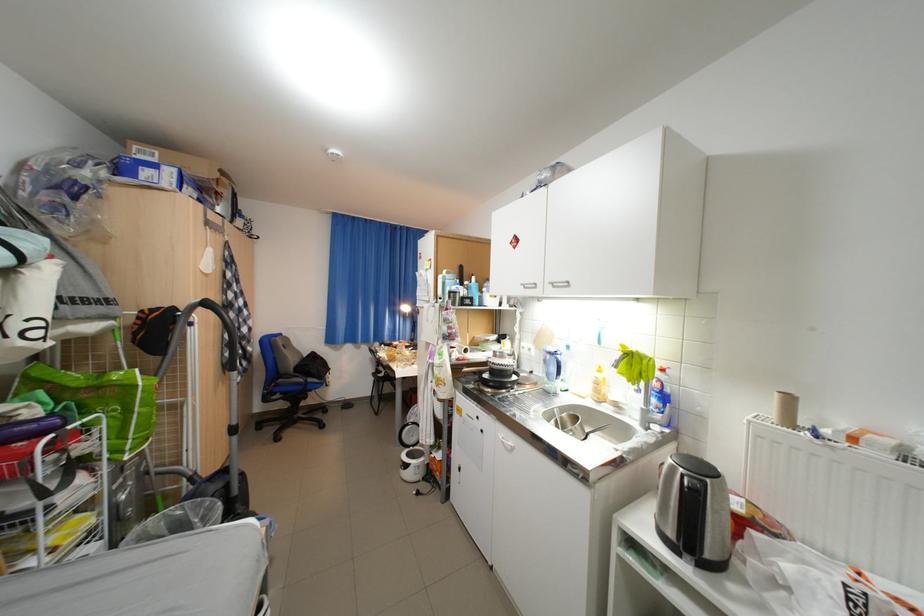
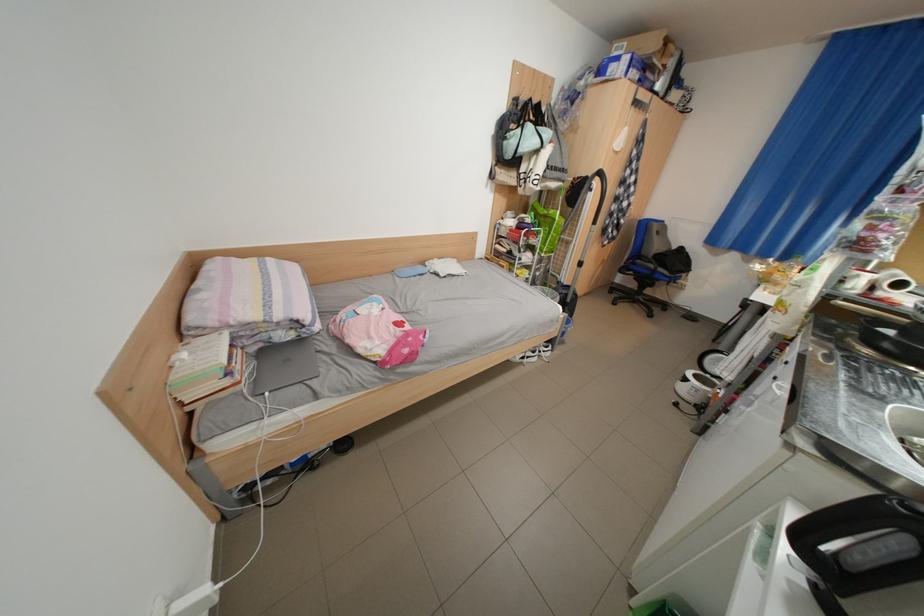
The point at (203, 496) is marked in the first image. Where is the corresponding point in the second image?

(565, 291)